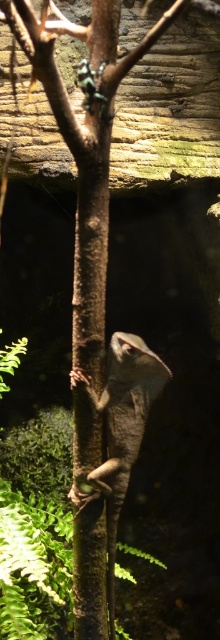
Can you confirm if brown rough tree trunk at center is positioned to the right of brown textured lizard at center?

Incorrect, brown rough tree trunk at center is not on the right side of brown textured lizard at center.

Between brown rough tree trunk at center and brown textured lizard at center, which one has more height?

brown rough tree trunk at center

Is point (104, 532) more distant than point (124, 371)?

That is True.

Image resolution: width=220 pixels, height=640 pixels. I want to click on brown rough tree trunk at center, so click(x=91, y=257).